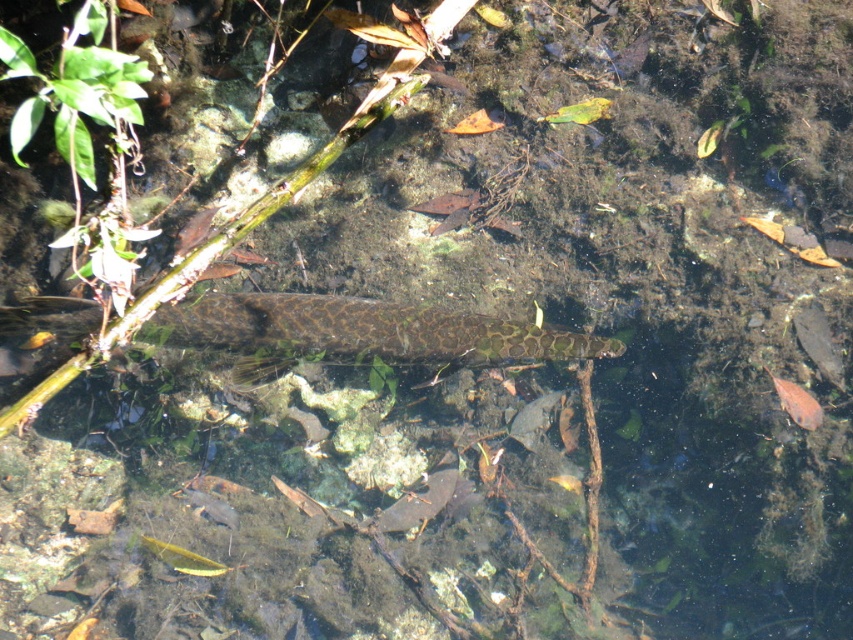
Question: Which point is farther from the camera taking this photo?

Choices:
 (A) (804, 410)
 (B) (556, 355)

Answer: (A)

Question: Does green textured snake at center appear over translucent orange fish at lower right?

Choices:
 (A) yes
 (B) no

Answer: (A)

Question: Does green textured snake at center appear over translucent orange fish at lower right?

Choices:
 (A) no
 (B) yes

Answer: (B)

Question: Which point is closer to the camera?

Choices:
 (A) (x=91, y=323)
 (B) (x=796, y=388)

Answer: (A)

Question: Among these objects, which one is nearest to the camera?

Choices:
 (A) translucent orange fish at lower right
 (B) green textured snake at center

Answer: (B)

Question: Can you confirm if green textured snake at center is thinner than translucent orange fish at lower right?

Choices:
 (A) yes
 (B) no

Answer: (B)